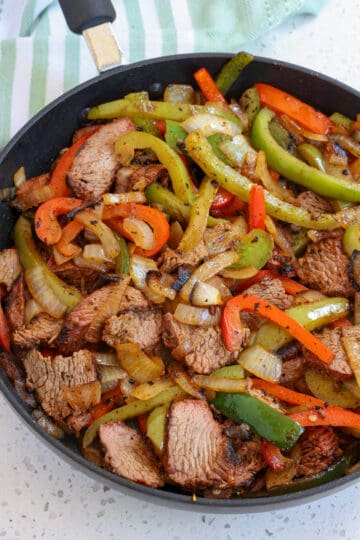
I want to click on countertop, so click(x=51, y=519).